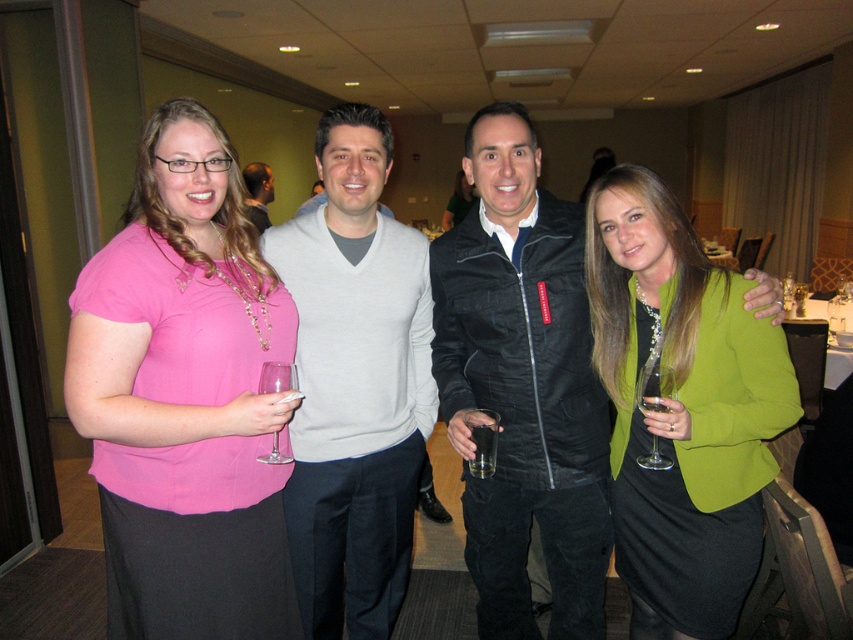
Question: Estimate the real-world distances between objects in this image. Which object is farther from the green matte blazer at center?

Choices:
 (A) light gray sweater at center
 (B) clear glass at center
 (C) clear glass wine glass at lower right

Answer: (A)

Question: Which point is closer to the camera taking this photo?

Choices:
 (A) (254, 182)
 (B) (735, 563)
 (C) (302, 320)

Answer: (B)

Question: Is green matte blazer at center in front of matte green dress at center?

Choices:
 (A) yes
 (B) no

Answer: (A)

Question: Is green matte blazer at center smaller than matte green dress at center?

Choices:
 (A) no
 (B) yes

Answer: (B)

Question: Which object appears farthest from the camera in this image?

Choices:
 (A) pink fabric shirt at left
 (B) clear glass at center
 (C) matte gray sweater at center

Answer: (C)

Question: Can you confirm if pink fabric shirt at left is bigger than green matte blazer at center?

Choices:
 (A) yes
 (B) no

Answer: (B)